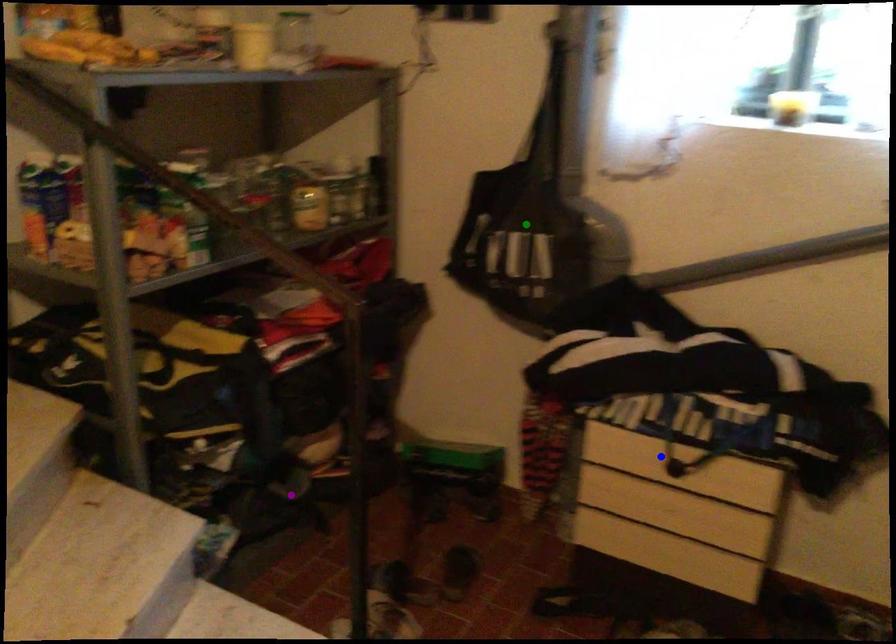
Order these from nearest to farthest:
blue point, purple point, green point

blue point, green point, purple point